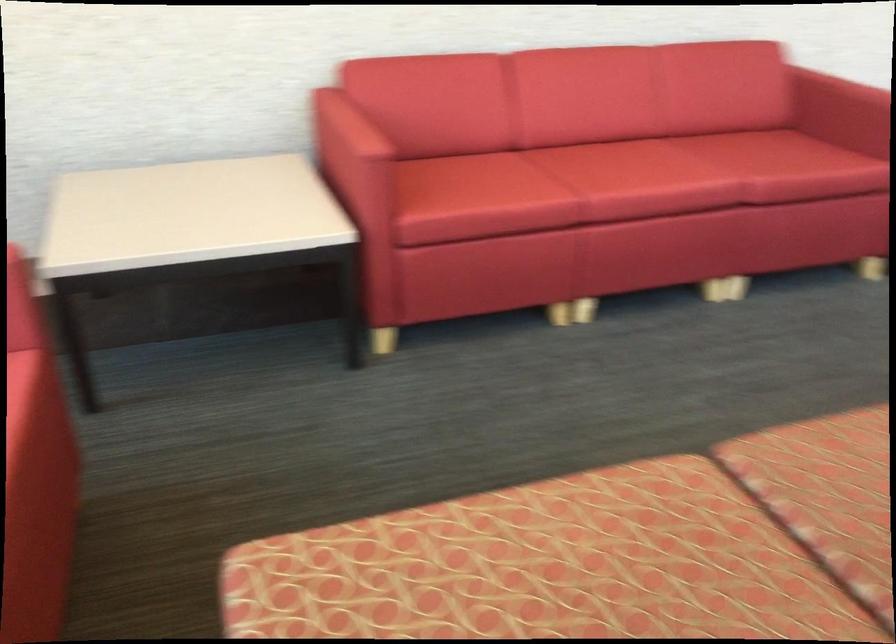
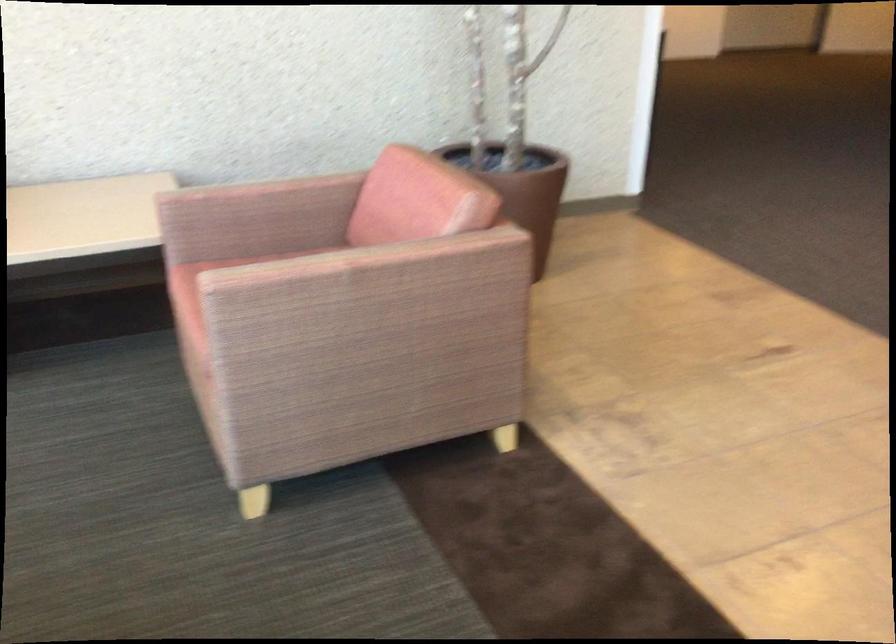
Question: What movement of the cameraman would produce the second image?

Choices:
 (A) Left
 (B) Right
 (C) Forward
 (D) Backward

Answer: (B)